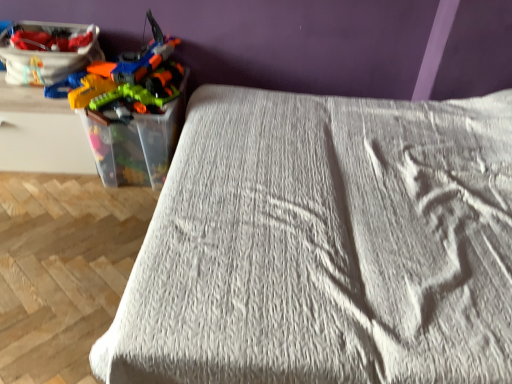
The height and width of the screenshot is (384, 512). What do you see at coordinates (47, 53) in the screenshot? I see `matte plastic toy box at upper left` at bounding box center [47, 53].

Describe the element at coordinates (325, 246) in the screenshot. Image resolution: width=512 pixels, height=384 pixels. I see `white textured bed at center` at that location.

Measure the distance between point (287, 183) and camera.

The distance of point (287, 183) from camera is 1.46 meters.

Find the location of `matte plastic toy box at upper left`. matte plastic toy box at upper left is located at coordinates (47, 53).

Locate an element on the screen. Image resolution: width=512 pixels, height=384 pixels. bed on the right of matte plastic toy box at upper left is located at coordinates (325, 246).

Are matte plastic toy box at upper left and white textured bed at center beside each other?

No, matte plastic toy box at upper left is not next to white textured bed at center.

Looking at this image, measure the distance from matte plastic toy box at upper left to white textured bed at center.

matte plastic toy box at upper left and white textured bed at center are 3.76 feet apart.

From a real-world perspective, between matte plastic toy box at upper left and white textured bed at center, who is vertically higher?

From a 3D spatial view, matte plastic toy box at upper left is above.

Considering their positions, is translucent plastic toy guns at left located in front of or behind white textured bed at center?

In the image, translucent plastic toy guns at left appears behind white textured bed at center.

From the picture: Is translucent plastic toy guns at left not close to white textured bed at center?

No, translucent plastic toy guns at left is in close proximity to white textured bed at center.

How distant is translucent plastic toy guns at left from white textured bed at center?

translucent plastic toy guns at left and white textured bed at center are 27.25 inches apart from each other.

Considering the positions of objects translucent plastic toy guns at left and white textured bed at center in the image provided, who is more to the right, translucent plastic toy guns at left or white textured bed at center?

white textured bed at center.

From the image's perspective, is white textured bed at center located above or below translucent plastic toy guns at left?

From the image's perspective, white textured bed at center appears below translucent plastic toy guns at left.

Considering the sizes of objects white textured bed at center and translucent plastic toy guns at left in the image provided, who is bigger, white textured bed at center or translucent plastic toy guns at left?

white textured bed at center is bigger.

Which object is positioned more to the left, white textured bed at center or translucent plastic toy guns at left?

Positioned to the left is translucent plastic toy guns at left.

Is white textured bed at center touching translucent plastic toy guns at left?

No, white textured bed at center is not beside translucent plastic toy guns at left.

Between matte plastic toy box at upper left and translucent plastic toy guns at left, which one appears on the right side from the viewer's perspective?

translucent plastic toy guns at left.

Where is `toy below the matte plastic toy box at upper left (from the image's perspective)`? The height and width of the screenshot is (384, 512). toy below the matte plastic toy box at upper left (from the image's perspective) is located at coordinates (133, 112).

From the image's perspective, is matte plastic toy box at upper left over translucent plastic toy guns at left?

Yes, from the image's perspective, matte plastic toy box at upper left is over translucent plastic toy guns at left.

From a real-world perspective, between matte plastic toy box at upper left and translucent plastic toy guns at left, who is vertically higher?

From a 3D spatial view, translucent plastic toy guns at left is above.

From a real-world perspective, is translucent plastic toy guns at left on top of matte plastic toy box at upper left?

Yes.

Considering their positions, is translucent plastic toy guns at left located in front of or behind matte plastic toy box at upper left?

In the image, translucent plastic toy guns at left appears in front of matte plastic toy box at upper left.

Is translucent plastic toy guns at left positioned with its back to matte plastic toy box at upper left?

translucent plastic toy guns at left does not have its back to matte plastic toy box at upper left.

Is white textured bed at center to the left of matte plastic toy box at upper left from the viewer's perspective?

No.

Is white textured bed at center further to the viewer compared to matte plastic toy box at upper left?

No, white textured bed at center is closer to the viewer.

Looking at the image, does white textured bed at center seem bigger or smaller compared to matte plastic toy box at upper left?

Considering their sizes, white textured bed at center takes up more space than matte plastic toy box at upper left.

The height and width of the screenshot is (384, 512). What are the coordinates of `bed on the right of the matte plastic toy box at upper left` in the screenshot? It's located at (325, 246).

Identify the location of toy above the white textured bed at center (from a real-world perspective). (133, 112).

Based on their spatial positions, is matte plastic toy box at upper left or white textured bed at center closer to translucent plastic toy guns at left?

The object closer to translucent plastic toy guns at left is matte plastic toy box at upper left.

Estimate the real-world distances between objects in this image. Which object is closer to translucent plastic toy guns at left, white textured bed at center or matte plastic toy box at upper left?

matte plastic toy box at upper left lies closer to translucent plastic toy guns at left than the other object.

Which object lies nearer to the anchor point matte plastic toy box at upper left, white textured bed at center or translucent plastic toy guns at left?

translucent plastic toy guns at left is positioned closer to the anchor matte plastic toy box at upper left.

Looking at the image, which one is located closer to white textured bed at center, matte plastic toy box at upper left or translucent plastic toy guns at left?

Based on the image, translucent plastic toy guns at left appears to be nearer to white textured bed at center.

Which object lies nearer to the anchor point matte plastic toy box at upper left, translucent plastic toy guns at left or white textured bed at center?

The object closer to matte plastic toy box at upper left is translucent plastic toy guns at left.

Considering their positions, is translucent plastic toy guns at left positioned closer to white textured bed at center than matte plastic toy box at upper left?

Based on the image, translucent plastic toy guns at left appears to be nearer to white textured bed at center.

What are the coordinates of `toy between matte plastic toy box at upper left and white textured bed at center` in the screenshot? It's located at (133, 112).